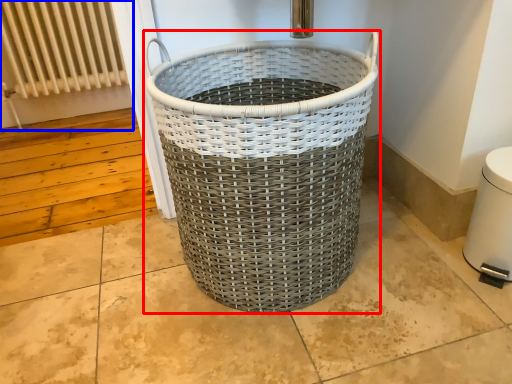
Question: Which point is closer to the camera, waste container (highlighted by a red box) or radiator (highlighted by a blue box)?

Choices:
 (A) waste container
 (B) radiator

Answer: (A)